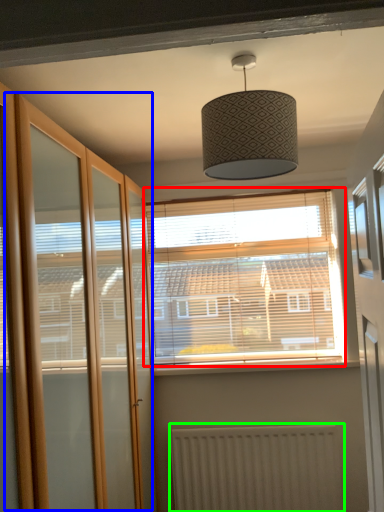
Question: Which is farther away from window (highlighted by a red box)? screen door (highlighted by a blue box) or radiator (highlighted by a green box)?

Choices:
 (A) screen door
 (B) radiator

Answer: (A)